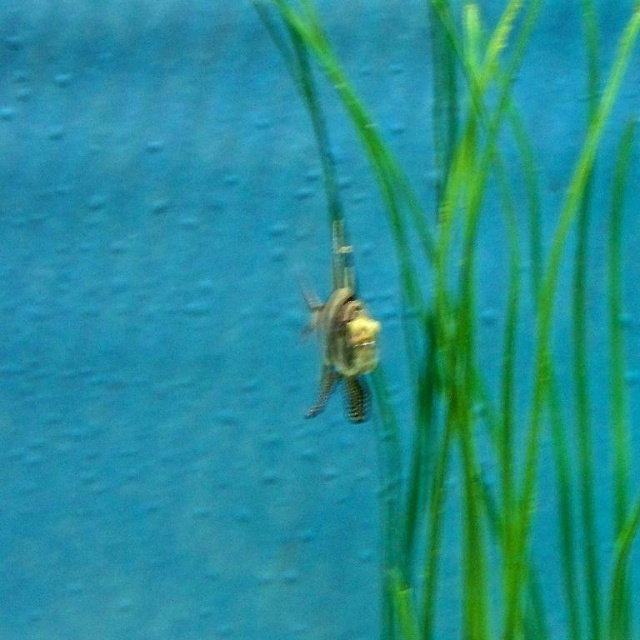
Question: Which of the following is the farthest from the observer?

Choices:
 (A) translucent plastic insect at center
 (B) green leafy grass at center

Answer: (A)

Question: Is green leafy grass at center wider than translucent plastic insect at center?

Choices:
 (A) yes
 (B) no

Answer: (A)

Question: Considering the relative positions of green leafy grass at center and translucent plastic insect at center in the image provided, where is green leafy grass at center located with respect to translucent plastic insect at center?

Choices:
 (A) left
 (B) right

Answer: (B)

Question: Is green leafy grass at center further to the viewer compared to translucent plastic insect at center?

Choices:
 (A) yes
 (B) no

Answer: (B)

Question: Which point is farther from the camera taking this photo?

Choices:
 (A) (595, 260)
 (B) (333, 221)

Answer: (A)